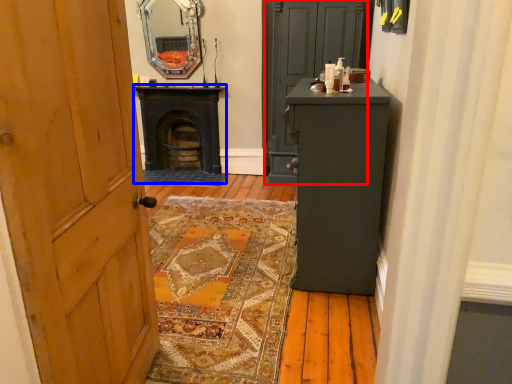
Question: Among these objects, which one is nearest to the camera, door (highlighted by a red box) or stove (highlighted by a blue box)?

Choices:
 (A) door
 (B) stove

Answer: (A)